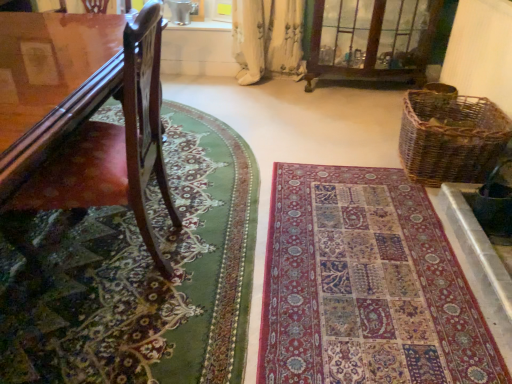
Identify the location of unoccupied area in front of clear glass cabinet at upper center. The width and height of the screenshot is (512, 384). (343, 119).